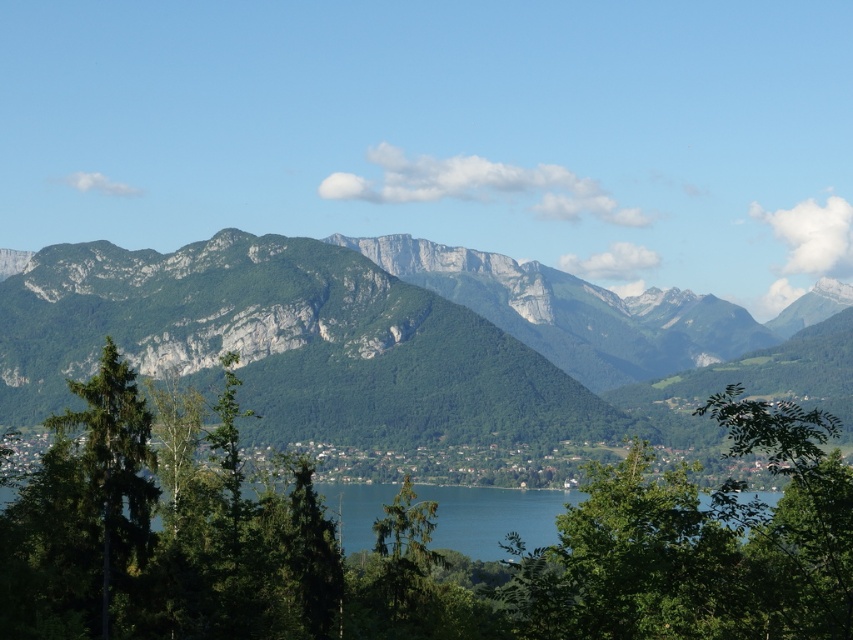
Between blue water at center and green matte tree at left, which one has more height?

With more height is blue water at center.

Does point (595, 486) come behind point (131, 481)?

That is True.

Identify the location of blue water at center. (651, 516).

Who is lower down, green forested mountain at center or blue water at center?

Positioned lower is blue water at center.

Describe the element at coordinates (370, 336) in the screenshot. I see `green forested mountain at center` at that location.

You are a GUI agent. You are given a task and a screenshot of the screen. Output one action in this format:
    pyautogui.click(x=<x>, y=<y>)
    Task: Click on the green forested mountain at center
    This screenshot has height=640, width=853.
    Given the screenshot: What is the action you would take?
    pos(370,336)

Does green leafy tree at center lie behind green forested mountain at center?

No, it is not.

Which of these two, green leafy tree at center or green forested mountain at center, stands taller?

Standing taller between the two is green forested mountain at center.

What do you see at coordinates (409, 540) in the screenshot?
I see `green leafy tree at center` at bounding box center [409, 540].

Where is `green leafy tree at center`? The width and height of the screenshot is (853, 640). green leafy tree at center is located at coordinates (409, 540).